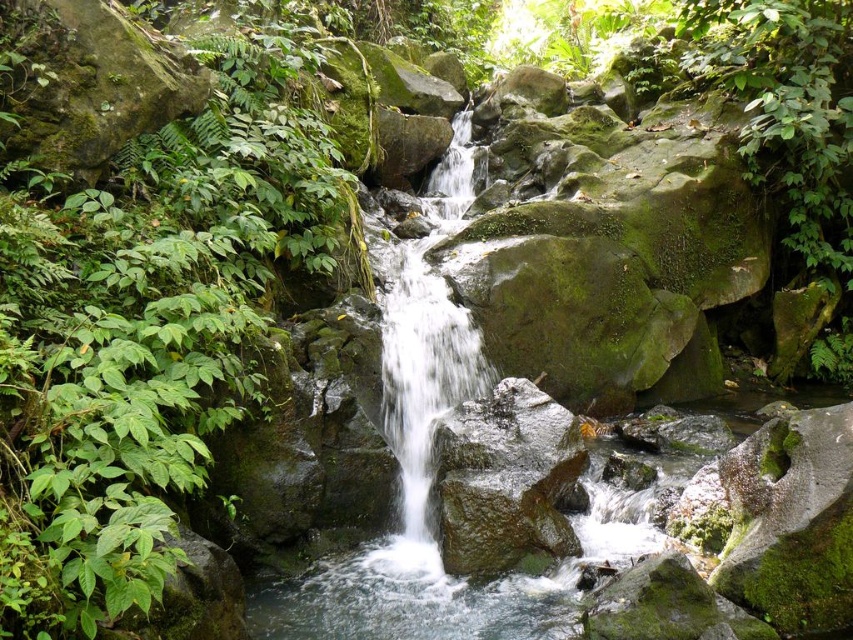
Is green leafy plant at left to the right of smooth gray rock at center from the viewer's perspective?

No, green leafy plant at left is not to the right of smooth gray rock at center.

Does point (53, 241) lie in front of point (410, 428)?

Yes, it is.

You are a GUI agent. You are given a task and a screenshot of the screen. Output one action in this format:
    pyautogui.click(x=<x>, y=<y>)
    Task: Click on the green leafy plant at left
    This screenshot has height=640, width=853.
    Given the screenshot: What is the action you would take?
    pyautogui.click(x=148, y=328)